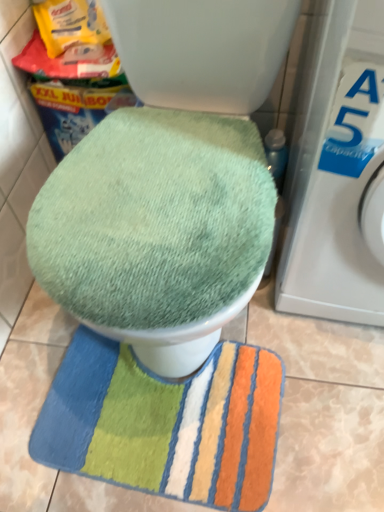
Question: Is white plastic washing machine at right not close to green plush rug at lower center?

Choices:
 (A) yes
 (B) no

Answer: (B)

Question: Considering the relative sizes of white plastic washing machine at right and green plush rug at lower center in the image provided, is white plastic washing machine at right smaller than green plush rug at lower center?

Choices:
 (A) no
 (B) yes

Answer: (A)

Question: Is white plastic washing machine at right not inside green plush rug at lower center?

Choices:
 (A) no
 (B) yes

Answer: (B)

Question: From a real-world perspective, does white plastic washing machine at right stand above green plush rug at lower center?

Choices:
 (A) yes
 (B) no

Answer: (A)

Question: Is white plastic washing machine at right taller than green plush rug at lower center?

Choices:
 (A) yes
 (B) no

Answer: (A)

Question: Is green fabric toilet seat at center bigger or smaller than white plastic washing machine at right?

Choices:
 (A) big
 (B) small

Answer: (A)

Question: Which is correct: green fabric toilet seat at center is inside white plastic washing machine at right, or outside of it?

Choices:
 (A) inside
 (B) outside

Answer: (B)

Question: Considering the positions of point (158, 6) and point (296, 226), is point (158, 6) closer or farther from the camera than point (296, 226)?

Choices:
 (A) farther
 (B) closer

Answer: (B)

Question: Based on their positions, is green fabric toilet seat at center located to the left or right of white plastic washing machine at right?

Choices:
 (A) left
 (B) right

Answer: (A)

Question: Do you think green fabric toilet seat at center is within green plush rug at lower center, or outside of it?

Choices:
 (A) inside
 (B) outside

Answer: (B)

Question: From the image's perspective, relative to green plush rug at lower center, is green fabric toilet seat at center above or below?

Choices:
 (A) below
 (B) above

Answer: (B)

Question: Looking at the image, does green fabric toilet seat at center seem bigger or smaller compared to green plush rug at lower center?

Choices:
 (A) small
 (B) big

Answer: (B)

Question: Considering the relative positions of green fabric toilet seat at center and green plush rug at lower center in the image provided, is green fabric toilet seat at center to the left or to the right of green plush rug at lower center?

Choices:
 (A) left
 (B) right

Answer: (B)

Question: From their relative heights in the image, would you say green plush rug at lower center is taller or shorter than white plastic washing machine at right?

Choices:
 (A) tall
 (B) short

Answer: (B)

Question: In the image, is green plush rug at lower center on the left side or the right side of white plastic washing machine at right?

Choices:
 (A) left
 (B) right

Answer: (A)